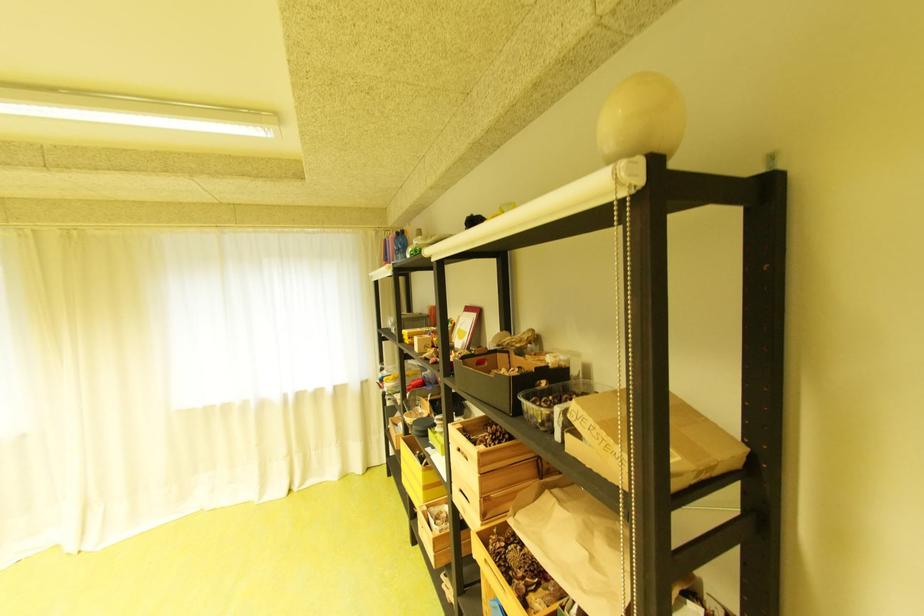
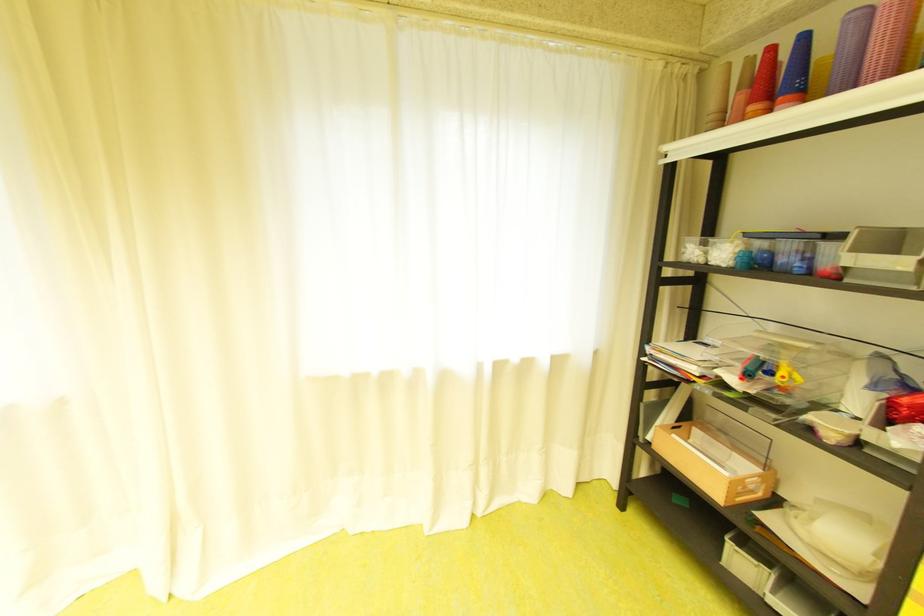
What movement of the cameraman would produce the second image?

The cameraman walked toward left, forward.